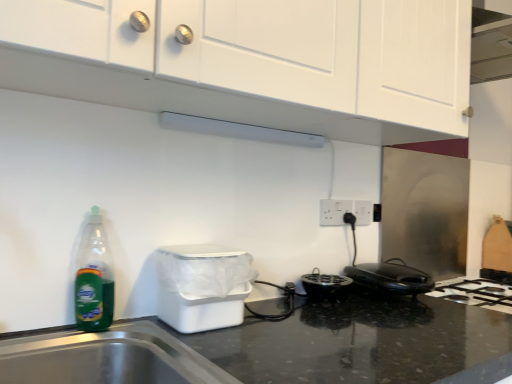
Question: Is black plastic toaster at lower right completely or partially inside white matte exhaust hood at upper center?

Choices:
 (A) yes
 (B) no

Answer: (B)

Question: Is white matte exhaust hood at upper center smaller than black plastic toaster at lower right?

Choices:
 (A) yes
 (B) no

Answer: (A)

Question: Would you say white matte exhaust hood at upper center is outside black plastic toaster at lower right?

Choices:
 (A) yes
 (B) no

Answer: (A)

Question: From a real-world perspective, does white matte exhaust hood at upper center stand above black plastic toaster at lower right?

Choices:
 (A) no
 (B) yes

Answer: (B)

Question: Does white matte exhaust hood at upper center have a greater width compared to black plastic toaster at lower right?

Choices:
 (A) yes
 (B) no

Answer: (B)

Question: Is black plastic toaster at lower right taller or shorter than white matte cabinet at upper center?

Choices:
 (A) short
 (B) tall

Answer: (A)

Question: In terms of width, does black plastic toaster at lower right look wider or thinner when compared to white matte cabinet at upper center?

Choices:
 (A) wide
 (B) thin

Answer: (B)

Question: Does point tap(400, 274) appear closer or farther from the camera than point tap(74, 89)?

Choices:
 (A) closer
 (B) farther

Answer: (B)

Question: Visually, is black plastic toaster at lower right positioned to the left or to the right of white matte cabinet at upper center?

Choices:
 (A) left
 (B) right

Answer: (B)

Question: Is white plastic electric outlet at center right, arranged as the 1th electric outlet when viewed from the left, wider or thinner than black plastic toaster at lower right?

Choices:
 (A) thin
 (B) wide

Answer: (A)

Question: Is white plastic electric outlet at center right, which is counted as the first electric outlet, starting from the front, bigger or smaller than black plastic toaster at lower right?

Choices:
 (A) big
 (B) small

Answer: (B)

Question: Considering the positions of point click(329, 213) and point click(367, 286), is point click(329, 213) closer or farther from the camera than point click(367, 286)?

Choices:
 (A) closer
 (B) farther

Answer: (B)

Question: Is white plastic electric outlet at center right, arranged as the 1th electric outlet when viewed from the left, taller or shorter than black plastic toaster at lower right?

Choices:
 (A) short
 (B) tall

Answer: (B)

Question: Looking at the image, does white plastic electric outlet at center right, arranged as the 1th electric outlet when viewed from the left, seem bigger or smaller compared to white plastic trash bin at lower left?

Choices:
 (A) small
 (B) big

Answer: (A)

Question: From the image's perspective, is white plastic electric outlet at center right, arranged as the 1th electric outlet when viewed from the left, located above or below white plastic trash bin at lower left?

Choices:
 (A) below
 (B) above

Answer: (B)